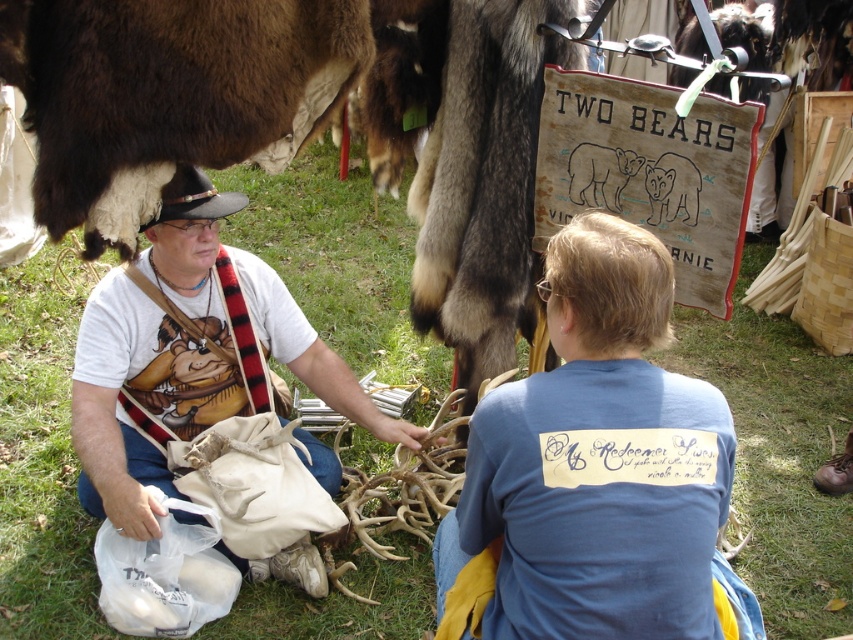
Question: Is blue cotton shirt at center smaller than white cotton t-shirt at center?

Choices:
 (A) yes
 (B) no

Answer: (A)

Question: Considering the real-world distances, which object is farthest from the black leather cowboy hat at upper left?

Choices:
 (A) white cotton t-shirt at center
 (B) green grass at center
 (C) blue cotton shirt at center

Answer: (B)

Question: Which of the following is the closest to the observer?

Choices:
 (A) click(x=352, y=632)
 (B) click(x=186, y=204)

Answer: (B)

Question: Which object appears closest to the camera in this image?

Choices:
 (A) blue cotton shirt at center
 (B) white cotton t-shirt at center
 (C) black leather cowboy hat at upper left

Answer: (A)

Question: Does green grass at center appear on the right side of blue cotton shirt at center?

Choices:
 (A) yes
 (B) no

Answer: (B)

Question: Does green grass at center appear under blue cotton shirt at center?

Choices:
 (A) yes
 (B) no

Answer: (B)